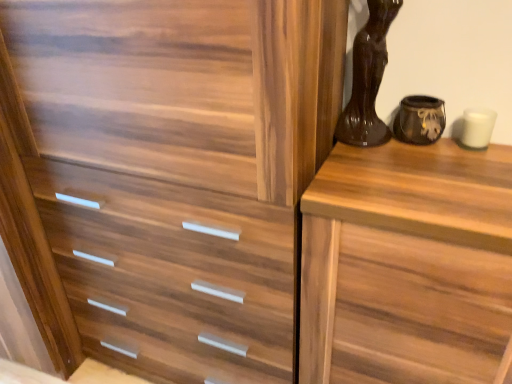
What do you see at coordinates (394, 218) in the screenshot?
I see `wooden chest of drawers at right` at bounding box center [394, 218].

Looking at this image, what is the approximate height of wooden chest of drawers at right?

wooden chest of drawers at right is 34.21 inches in height.

Find the location of `shiny brown vase at upper right, the first vase from the left`. shiny brown vase at upper right, the first vase from the left is located at coordinates point(368,79).

Locate an element on the screen. The width and height of the screenshot is (512, 384). wooden chest of drawers at right is located at coordinates (394, 218).

From a real-world perspective, does shiny brown vase at upper right, the first vase from the left, sit lower than matte black vase at upper right, arranged as the 2th vase when viewed from the left?

No, from a real-world perspective, shiny brown vase at upper right, the first vase from the left, is not beneath matte black vase at upper right, arranged as the 2th vase when viewed from the left.

Is point (366, 89) in front of point (434, 114)?

That is False.

Considering the positions of objects shiny brown vase at upper right, the first vase from the left, and matte black vase at upper right, arranged as the 2th vase when viewed from the left, in the image provided, who is behind, shiny brown vase at upper right, the first vase from the left, or matte black vase at upper right, arranged as the 2th vase when viewed from the left,?

matte black vase at upper right, arranged as the 2th vase when viewed from the left, is more distant.

Is wooden chest of drawers at right far from shiny brown vase at upper right, which is the 2th vase in right-to-left order?

wooden chest of drawers at right is actually quite close to shiny brown vase at upper right, which is the 2th vase in right-to-left order.

Consider the image. Can we say wooden chest of drawers at right lies outside shiny brown vase at upper right, the first vase from the left?

Yes.

Which is more distant, (483, 166) or (356, 40)?

Point (356, 40)

What's the angular difference between wooden chest of drawers at right and shiny brown vase at upper right, which is the 2th vase in right-to-left order,'s facing directions?

There is a 1.13-degree angle between the facing directions of wooden chest of drawers at right and shiny brown vase at upper right, which is the 2th vase in right-to-left order.

Considering the sizes of objects shiny brown vase at upper right, the first vase from the left, and wooden chest of drawers at right in the image provided, who is smaller, shiny brown vase at upper right, the first vase from the left, or wooden chest of drawers at right?

Smaller between the two is shiny brown vase at upper right, the first vase from the left.

Considering the sizes of objects shiny brown vase at upper right, the first vase from the left, and wooden chest of drawers at right in the image provided, who is thinner, shiny brown vase at upper right, the first vase from the left, or wooden chest of drawers at right?

Thinner between the two is shiny brown vase at upper right, the first vase from the left.

From a real-world perspective, between shiny brown vase at upper right, the first vase from the left, and wooden chest of drawers at right, who is vertically lower?

In real-world perspective, wooden chest of drawers at right is lower.

Between point (379, 21) and point (490, 193), which one is positioned behind?

Point (379, 21)

Which object is wider, wooden chest of drawers at right or matte black vase at upper right, marked as the 1th vase in a right-to-left arrangement?

wooden chest of drawers at right.

Between wooden chest of drawers at right and matte black vase at upper right, arranged as the 2th vase when viewed from the left, which one appears on the left side from the viewer's perspective?

matte black vase at upper right, arranged as the 2th vase when viewed from the left.

Who is taller, wooden chest of drawers at right or matte black vase at upper right, marked as the 1th vase in a right-to-left arrangement?

wooden chest of drawers at right.

Could you tell me if wooden chest of drawers at right is facing matte black vase at upper right, marked as the 1th vase in a right-to-left arrangement?

No, wooden chest of drawers at right is not oriented towards matte black vase at upper right, marked as the 1th vase in a right-to-left arrangement.

Who is bigger, matte black vase at upper right, marked as the 1th vase in a right-to-left arrangement, or wooden chest of drawers at right?

wooden chest of drawers at right.

Between point (407, 118) and point (378, 195), which one is positioned behind?

The point (407, 118) is more distant.

Is matte black vase at upper right, arranged as the 2th vase when viewed from the left, located outside wooden chest of drawers at right?

No, matte black vase at upper right, arranged as the 2th vase when viewed from the left, is not outside of wooden chest of drawers at right.

The image size is (512, 384). Identify the location of chest of drawers located on the right of matte black vase at upper right, marked as the 1th vase in a right-to-left arrangement. coord(394,218).

Which of these two, matte black vase at upper right, arranged as the 2th vase when viewed from the left, or shiny brown vase at upper right, the first vase from the left, is thinner?

With smaller width is matte black vase at upper right, arranged as the 2th vase when viewed from the left.

In the scene shown: Is matte black vase at upper right, arranged as the 2th vase when viewed from the left, to the right of shiny brown vase at upper right, which is the 2th vase in right-to-left order, from the viewer's perspective?

Yes, matte black vase at upper right, arranged as the 2th vase when viewed from the left, is to the right of shiny brown vase at upper right, which is the 2th vase in right-to-left order.

Does point (404, 101) appear closer or farther from the camera than point (368, 133)?

Point (404, 101) is closer to the camera than point (368, 133).

From a real-world perspective, is matte black vase at upper right, arranged as the 2th vase when viewed from the left, on top of shiny brown vase at upper right, the first vase from the left?

No, from a real-world perspective, matte black vase at upper right, arranged as the 2th vase when viewed from the left, is not above shiny brown vase at upper right, the first vase from the left.

At what (x,y) coordinates should I click in order to perform the action: click on vase that is behind the shiny brown vase at upper right, the first vase from the left. Please return your answer as a coordinate pair (x, y). This screenshot has width=512, height=384. Looking at the image, I should click on (419, 120).

The width and height of the screenshot is (512, 384). What are the coordinates of `chest of drawers lying on the right of shiny brown vase at upper right, the first vase from the left` in the screenshot? It's located at (394, 218).

From the image, which object appears to be farther from matte black vase at upper right, arranged as the 2th vase when viewed from the left, shiny brown vase at upper right, which is the 2th vase in right-to-left order, or wooden chest of drawers at right?

wooden chest of drawers at right is further to matte black vase at upper right, arranged as the 2th vase when viewed from the left.

Based on their spatial positions, is shiny brown vase at upper right, which is the 2th vase in right-to-left order, or matte black vase at upper right, arranged as the 2th vase when viewed from the left, further from wooden chest of drawers at right?

matte black vase at upper right, arranged as the 2th vase when viewed from the left, is further to wooden chest of drawers at right.

Estimate the real-world distances between objects in this image. Which object is closer to shiny brown vase at upper right, the first vase from the left, matte black vase at upper right, marked as the 1th vase in a right-to-left arrangement, or wooden chest of drawers at right?

Based on the image, matte black vase at upper right, marked as the 1th vase in a right-to-left arrangement, appears to be nearer to shiny brown vase at upper right, the first vase from the left.

Which object lies nearer to the anchor point shiny brown vase at upper right, the first vase from the left, wooden chest of drawers at right or matte black vase at upper right, arranged as the 2th vase when viewed from the left?

Based on the image, matte black vase at upper right, arranged as the 2th vase when viewed from the left, appears to be nearer to shiny brown vase at upper right, the first vase from the left.

From the image, which object appears to be farther from matte black vase at upper right, arranged as the 2th vase when viewed from the left, wooden chest of drawers at right or shiny brown vase at upper right, the first vase from the left?

Among the two, wooden chest of drawers at right is located further to matte black vase at upper right, arranged as the 2th vase when viewed from the left.

Which object lies nearer to the anchor point wooden chest of drawers at right, matte black vase at upper right, arranged as the 2th vase when viewed from the left, or shiny brown vase at upper right, which is the 2th vase in right-to-left order?

shiny brown vase at upper right, which is the 2th vase in right-to-left order, is closer to wooden chest of drawers at right.

You are a GUI agent. You are given a task and a screenshot of the screen. Output one action in this format:
    pyautogui.click(x=<x>, y=<y>)
    Task: Click on the vase that lies between shiny brown vase at upper right, the first vase from the left, and wooden chest of drawers at right from top to bottom
    Image resolution: width=512 pixels, height=384 pixels.
    Given the screenshot: What is the action you would take?
    (419, 120)